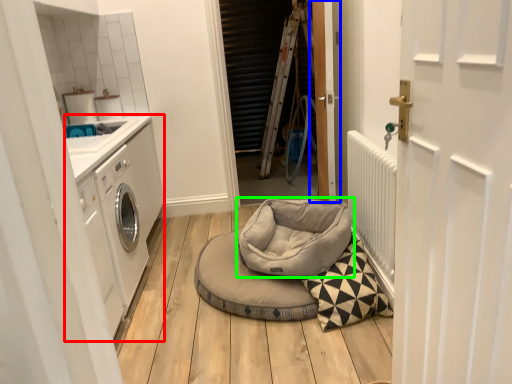
Question: Which object is the farthest from washing machine (highlighted by a red box)? Choose among these: door (highlighted by a blue box) or dog bed (highlighted by a green box).

Choices:
 (A) door
 (B) dog bed

Answer: (A)